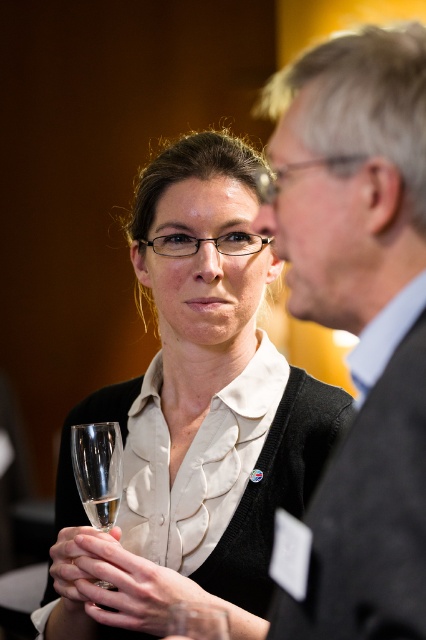
Question: Which of the following is the closest to the observer?

Choices:
 (A) (109, 524)
 (B) (393, 269)

Answer: (B)

Question: Which point appears farthest from the camera in this image?

Choices:
 (A) (86, 500)
 (B) (270, 170)

Answer: (B)

Question: Can you confirm if matte gray suit at center is thinner than black plastic glasses at center?

Choices:
 (A) yes
 (B) no

Answer: (A)

Question: Is transparent plastic glasses at upper center closer to the viewer compared to clear glass wine at center?

Choices:
 (A) yes
 (B) no

Answer: (A)

Question: Which object appears farthest from the camera in this image?

Choices:
 (A) transparent plastic glasses at upper center
 (B) matte black sweater at center

Answer: (B)

Question: Does transparent plastic glasses at upper center have a larger size compared to clear glass wine at center?

Choices:
 (A) yes
 (B) no

Answer: (A)